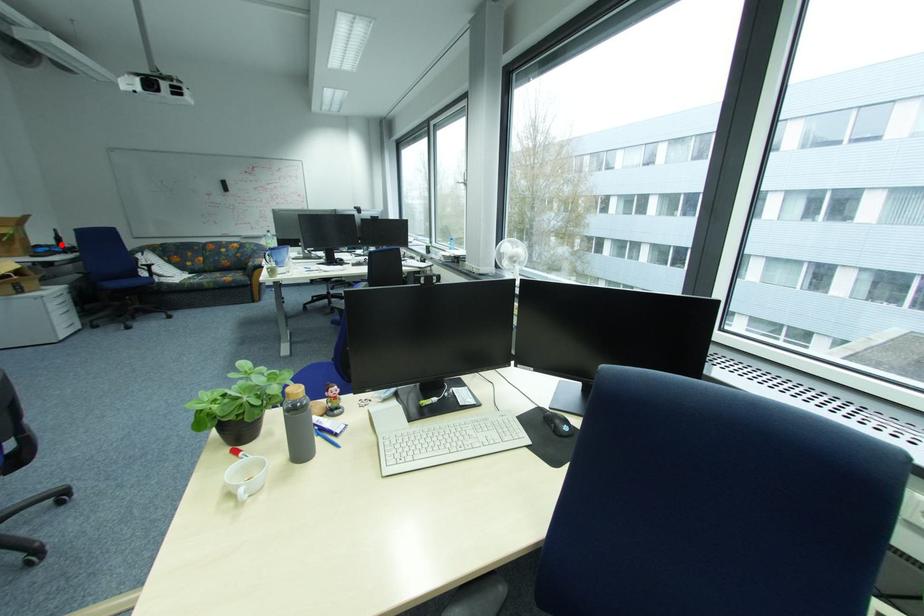
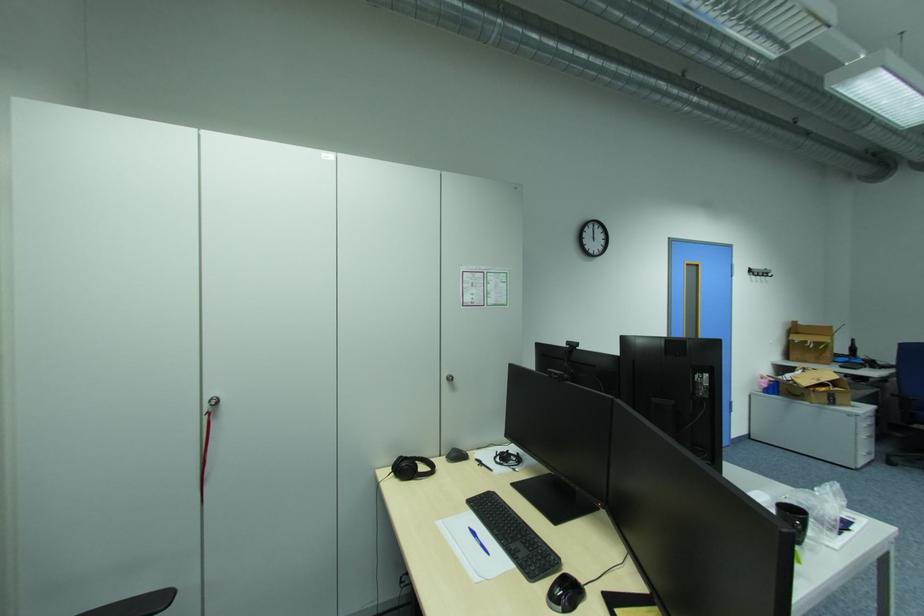
Where in the second image is the point corresponding to the highlighted location from the first image?

(855, 354)